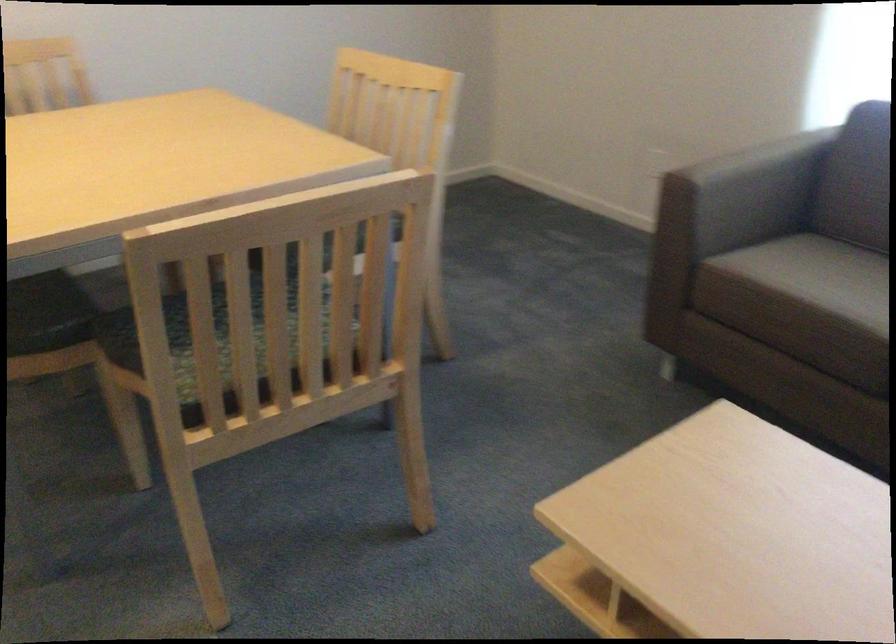
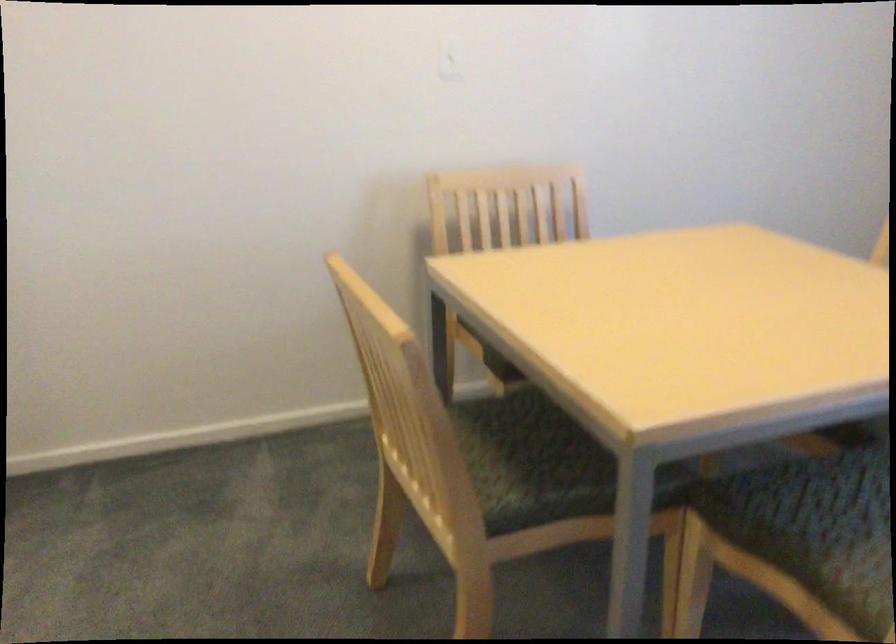
Question: In a continuous first-person perspective shot, in which direction is the camera moving?

Choices:
 (A) Left
 (B) Right
 (C) Forward
 (D) Backward

Answer: (A)